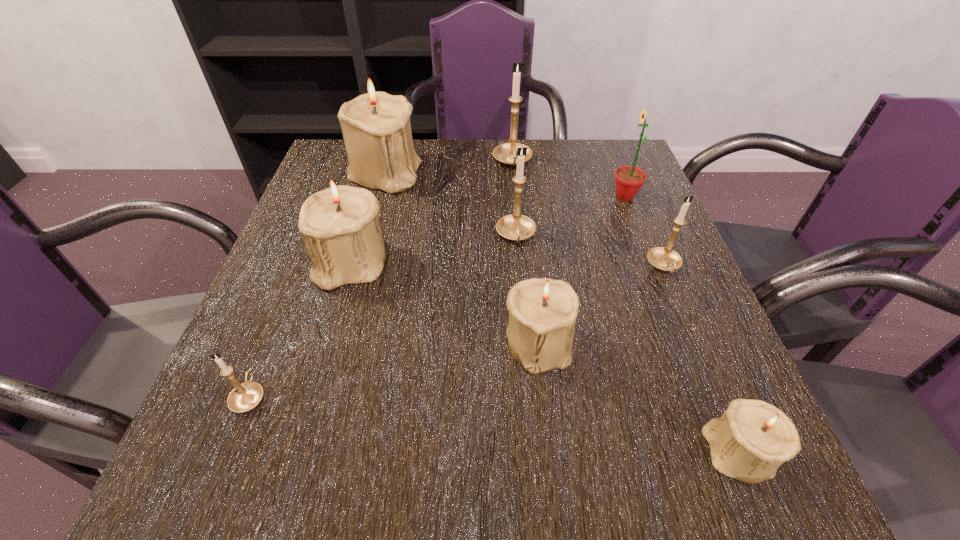
Point out which beige candle_holder is positioned as the fourth nearest to the biggest gold candle holder. Please provide its 2D coordinates. Your answer should be formatted as a tuple, i.e. [(x, y)], where the tuple contains the x and y coordinates of a point satisfying the conditions above.

[(752, 439)]

Point out which beige candle_holder is positioned as the second nearest to the third nearest beige candle_holder. Please provide its 2D coordinates. Your answer should be formatted as a tuple, i.e. [(x, y)], where the tuple contains the x and y coordinates of a point satisfying the conditions above.

[(542, 311)]

This screenshot has width=960, height=540. Identify the location of free space that satisfies the following two spatial constraints: 1. on the face of the sunflower; 2. on the front side of the third nearest object. (681, 342).

This screenshot has height=540, width=960. In order to click on vacant position in the image that satisfies the following two spatial constraints: 1. on the handle side of the second biggest beige candle_holder; 2. on the right side of the second nearest candle_holder in this screenshot , I will do `click(302, 264)`.

Identify the location of blank area in the image that satisfies the following two spatial constraints: 1. on the handle side of the second farthest beige candle_holder; 2. on the right side of the eighth farthest object. The image size is (960, 540). (302, 264).

At what (x,y) coordinates should I click in order to perform the action: click on blank space that satisfies the following two spatial constraints: 1. on the front side of the third nearest beige candle_holder; 2. on the right side of the nearest beige candle_holder. Please return your answer as a coordinate pair (x, y). Looking at the image, I should click on (300, 452).